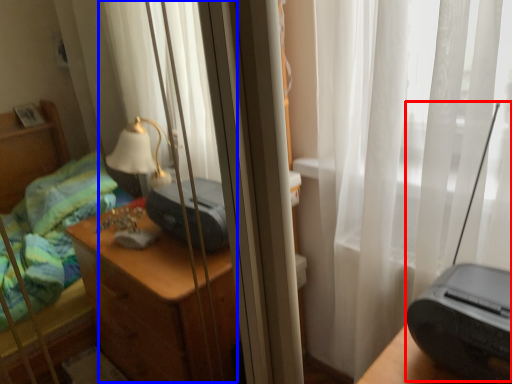
Question: Which point is closer to the camera, equipment (highlighted by a red box) or curtain (highlighted by a blue box)?

Choices:
 (A) equipment
 (B) curtain

Answer: (A)